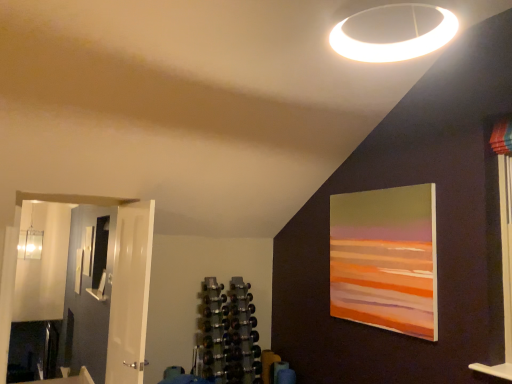
This screenshot has height=384, width=512. In order to click on matte acrylic painting at upper right, which is the first picture frame from front to back in this screenshot , I will do `click(385, 259)`.

What do you see at coordinates (385, 259) in the screenshot? I see `matte acrylic painting at upper right, which is the first picture frame from front to back` at bounding box center [385, 259].

Where is `metallic dumbbell rack at center`? metallic dumbbell rack at center is located at coordinates (227, 334).

Is matte acrylic painting at upper right, which is the first picture frame from front to back, spatially inside metallic dumbbell rack at center, or outside of it?

matte acrylic painting at upper right, which is the first picture frame from front to back, is spatially situated outside metallic dumbbell rack at center.

Considering the sizes of matte acrylic painting at upper right, which is the first picture frame from front to back, and metallic dumbbell rack at center in the image, is matte acrylic painting at upper right, which is the first picture frame from front to back, bigger or smaller than metallic dumbbell rack at center?

Clearly, matte acrylic painting at upper right, which is the first picture frame from front to back, is smaller in size than metallic dumbbell rack at center.

From their relative heights in the image, would you say matte acrylic painting at upper right, the 1th picture frame viewed from the top, is taller or shorter than metallic dumbbell rack at center?

Clearly, matte acrylic painting at upper right, the 1th picture frame viewed from the top, is shorter compared to metallic dumbbell rack at center.

Is matte acrylic painting at upper right, marked as the second picture frame in a left-to-right arrangement, to the right of metallic dumbbell rack at center from the viewer's perspective?

Indeed, matte acrylic painting at upper right, marked as the second picture frame in a left-to-right arrangement, is positioned on the right side of metallic dumbbell rack at center.

Measure the distance from matte white picture frame at left, the 1th picture frame viewed from the left, to matte acrylic painting at upper right, placed as the second picture frame when sorted from back to front.

4.92 meters.

Is matte white picture frame at left, placed as the 1th picture frame when sorted from bottom to top, far from matte acrylic painting at upper right, the second picture frame when ordered from bottom to top?

Yes.

From a real-world perspective, who is located lower, matte white picture frame at left, the 1th picture frame viewed from the left, or matte acrylic painting at upper right, which is the first picture frame from front to back?

matte white picture frame at left, the 1th picture frame viewed from the left.

Based on the photo, from the image's perspective, is matte white picture frame at left, placed as the 1th picture frame when sorted from bottom to top, positioned above or below matte acrylic painting at upper right, which is the first picture frame from front to back?

matte white picture frame at left, placed as the 1th picture frame when sorted from bottom to top, is below matte acrylic painting at upper right, which is the first picture frame from front to back.

From the image's perspective, which one is positioned lower, white glossy door at left or matte white picture frame at left, the 2th picture frame positioned from the top?

matte white picture frame at left, the 2th picture frame positioned from the top, is shown below in the image.

Does white glossy door at left turn towards matte white picture frame at left, the 2th picture frame viewed from the right?

No, white glossy door at left does not turn towards matte white picture frame at left, the 2th picture frame viewed from the right.

From the picture: Considering the sizes of objects white glossy door at left and matte white picture frame at left, placed as the 1th picture frame when sorted from bottom to top, in the image provided, who is wider, white glossy door at left or matte white picture frame at left, placed as the 1th picture frame when sorted from bottom to top,?

white glossy door at left is wider.

Can we say white glossy door at left lies outside matte white picture frame at left, which appears as the 2th picture frame when viewed from the front?

Absolutely, white glossy door at left is external to matte white picture frame at left, which appears as the 2th picture frame when viewed from the front.

From the image's perspective, is matte acrylic painting at upper right, acting as the 1th picture frame starting from the right, above or below white glossy door at left?

matte acrylic painting at upper right, acting as the 1th picture frame starting from the right, is above white glossy door at left.

Is matte acrylic painting at upper right, marked as the second picture frame in a left-to-right arrangement, next to white glossy door at left?

No.

Choose the correct answer: Is matte acrylic painting at upper right, which is the first picture frame from front to back, inside white glossy door at left or outside it?

matte acrylic painting at upper right, which is the first picture frame from front to back, exists outside the volume of white glossy door at left.

What's the angular difference between matte white picture frame at left, placed as the 1th picture frame when sorted from bottom to top, and white glossy door at left's facing directions?

The facing directions of matte white picture frame at left, placed as the 1th picture frame when sorted from bottom to top, and white glossy door at left are 1.03 degrees apart.

Which object is positioned more to the left, matte white picture frame at left, placed as the 1th picture frame when sorted from bottom to top, or white glossy door at left?

matte white picture frame at left, placed as the 1th picture frame when sorted from bottom to top.

From a real-world perspective, is matte white picture frame at left, the 2th picture frame viewed from the right, beneath white glossy door at left?

Yes, from a real-world perspective, matte white picture frame at left, the 2th picture frame viewed from the right, is under white glossy door at left.

Considering the relative sizes of matte white picture frame at left, placed as the 1th picture frame when sorted from bottom to top, and white glossy door at left in the image provided, is matte white picture frame at left, placed as the 1th picture frame when sorted from bottom to top, wider than white glossy door at left?

No.

From a real-world perspective, is metallic dumbbell rack at center on matte white picture frame at left, the 1th picture frame viewed from the left?

Incorrect, from a real-world perspective, metallic dumbbell rack at center is lower than matte white picture frame at left, the 1th picture frame viewed from the left.

Looking at their sizes, would you say metallic dumbbell rack at center is wider or thinner than matte white picture frame at left, the 1th picture frame viewed from the left?

Considering their sizes, metallic dumbbell rack at center looks broader than matte white picture frame at left, the 1th picture frame viewed from the left.

Find the location of a particular element. Image resolution: width=512 pixels, height=384 pixels. picture frame behind the metallic dumbbell rack at center is located at coordinates (78, 270).

Is metallic dumbbell rack at center shorter than matte white picture frame at left, which appears as the 2th picture frame when viewed from the front?

In fact, metallic dumbbell rack at center may be taller than matte white picture frame at left, which appears as the 2th picture frame when viewed from the front.

Between matte white picture frame at left, which appears as the 2th picture frame when viewed from the front, and metallic dumbbell rack at center, which one has smaller size?

matte white picture frame at left, which appears as the 2th picture frame when viewed from the front, is smaller.

What's the angular difference between matte white picture frame at left, placed as the 1th picture frame when sorted from bottom to top, and metallic dumbbell rack at center's facing directions?

88.7 degrees.

Does matte white picture frame at left, which appears as the 2th picture frame when viewed from the front, touch metallic dumbbell rack at center?

No, matte white picture frame at left, which appears as the 2th picture frame when viewed from the front, is not with metallic dumbbell rack at center.

Is metallic dumbbell rack at center a part of matte white picture frame at left, placed as the 1th picture frame when sorted from bottom to top?

Definitely not — metallic dumbbell rack at center is not inside matte white picture frame at left, placed as the 1th picture frame when sorted from bottom to top.

Where is `picture frame that is in front of the metallic dumbbell rack at center`? The image size is (512, 384). picture frame that is in front of the metallic dumbbell rack at center is located at coordinates (385, 259).

Identify the location of picture frame below the matte acrylic painting at upper right, placed as the second picture frame when sorted from back to front (from the image's perspective). The image size is (512, 384). (78, 270).

Looking at the image, which one is located closer to white glossy door at left, matte white picture frame at left, placed as the 1th picture frame when sorted from bottom to top, or matte acrylic painting at upper right, acting as the 1th picture frame starting from the right?

Among the two, matte acrylic painting at upper right, acting as the 1th picture frame starting from the right, is located nearer to white glossy door at left.

From the image, which object appears to be farther from matte acrylic painting at upper right, the second picture frame when ordered from bottom to top, matte white picture frame at left, the 1th picture frame viewed from the left, or white glossy door at left?

matte white picture frame at left, the 1th picture frame viewed from the left, is positioned further to the anchor matte acrylic painting at upper right, the second picture frame when ordered from bottom to top.

When comparing their distances from matte white picture frame at left, placed as the 1th picture frame when sorted from back to front, does white glossy door at left or matte acrylic painting at upper right, marked as the second picture frame in a left-to-right arrangement, seem further?

matte acrylic painting at upper right, marked as the second picture frame in a left-to-right arrangement.

When comparing their distances from white glossy door at left, does metallic dumbbell rack at center or matte white picture frame at left, which appears as the 2th picture frame when viewed from the front, seem further?

matte white picture frame at left, which appears as the 2th picture frame when viewed from the front.

Estimate the real-world distances between objects in this image. Which object is closer to matte acrylic painting at upper right, which is the first picture frame from front to back, metallic dumbbell rack at center or matte white picture frame at left, placed as the 1th picture frame when sorted from back to front?

metallic dumbbell rack at center is positioned closer to the anchor matte acrylic painting at upper right, which is the first picture frame from front to back.

From the image, which object appears to be farther from matte white picture frame at left, placed as the 1th picture frame when sorted from bottom to top, matte acrylic painting at upper right, which is the first picture frame from front to back, or metallic dumbbell rack at center?

matte acrylic painting at upper right, which is the first picture frame from front to back, is positioned further to the anchor matte white picture frame at left, placed as the 1th picture frame when sorted from bottom to top.

When comparing their distances from metallic dumbbell rack at center, does white glossy door at left or matte white picture frame at left, which appears as the 2th picture frame when viewed from the front, seem further?

Based on the image, matte white picture frame at left, which appears as the 2th picture frame when viewed from the front, appears to be further to metallic dumbbell rack at center.

Looking at this image, looking at the image, which one is located closer to metallic dumbbell rack at center, matte acrylic painting at upper right, marked as the second picture frame in a left-to-right arrangement, or white glossy door at left?

The object closer to metallic dumbbell rack at center is white glossy door at left.

Identify the location of shelf located between white glossy door at left and matte acrylic painting at upper right, the second picture frame when ordered from bottom to top, in the left-right direction. (227, 334).

Where is `shelf positioned between white glossy door at left and matte white picture frame at left, the 2th picture frame viewed from the right, from near to far`? The height and width of the screenshot is (384, 512). shelf positioned between white glossy door at left and matte white picture frame at left, the 2th picture frame viewed from the right, from near to far is located at coordinates (227, 334).

Identify the location of door located between matte acrylic painting at upper right, placed as the second picture frame when sorted from back to front, and matte white picture frame at left, the 2th picture frame viewed from the right, in the depth direction. (130, 293).

This screenshot has width=512, height=384. I want to click on shelf between matte white picture frame at left, placed as the 1th picture frame when sorted from bottom to top, and matte acrylic painting at upper right, the second picture frame when ordered from bottom to top, from left to right, so click(227, 334).